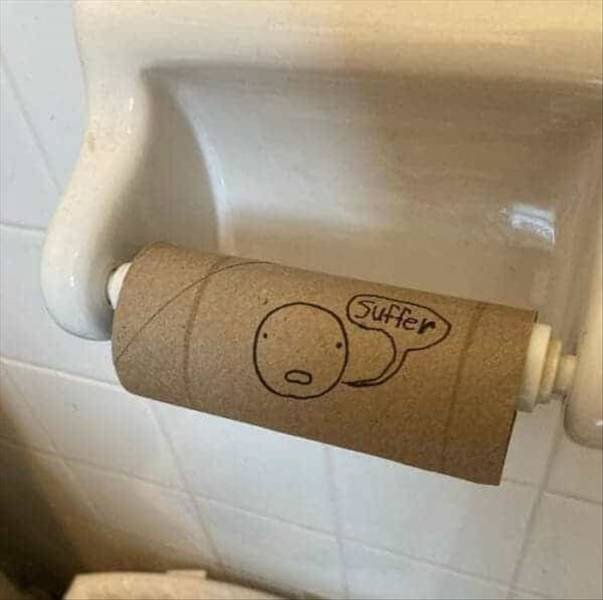
Locate an element on the screen. The height and width of the screenshot is (600, 603). grout is located at coordinates (163, 469).